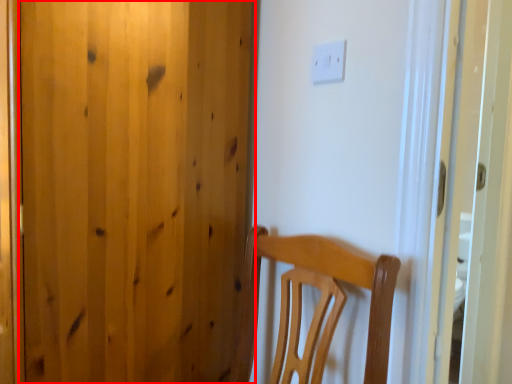
Question: Observing the image, what is the correct spatial positioning of door (annotated by the red box) in reference to light switch?

Choices:
 (A) left
 (B) right

Answer: (A)